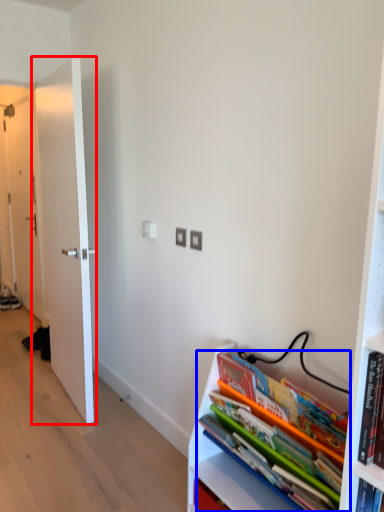
Question: Which object is closer to the camera taking this photo, door (highlighted by a red box) or book (highlighted by a blue box)?

Choices:
 (A) door
 (B) book

Answer: (B)